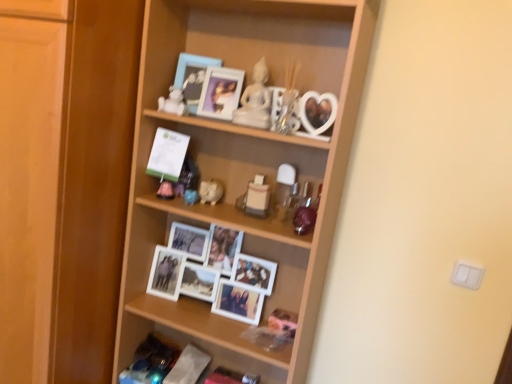
Question: From the image's perspective, is matte blue picture frame at upper center, the 1th picture frame from the left, below wooden shelf at center, marked as the second shelf in a bottom-to-top arrangement?

Choices:
 (A) yes
 (B) no

Answer: (B)

Question: Considering the relative sizes of matte blue picture frame at upper center, the 1th picture frame from the left, and wooden shelf at center, marked as the second shelf in a bottom-to-top arrangement, in the image provided, is matte blue picture frame at upper center, the 1th picture frame from the left, wider than wooden shelf at center, marked as the second shelf in a bottom-to-top arrangement,?

Choices:
 (A) no
 (B) yes

Answer: (A)

Question: Is matte blue picture frame at upper center, the 1th picture frame from the left, positioned far away from wooden shelf at center, marked as the second shelf in a bottom-to-top arrangement?

Choices:
 (A) no
 (B) yes

Answer: (A)

Question: Are matte blue picture frame at upper center, which is the second picture frame from right to left, and wooden shelf at center, which is counted as the 1th shelf, starting from the top, making contact?

Choices:
 (A) yes
 (B) no

Answer: (B)

Question: Is matte blue picture frame at upper center, the 1th picture frame from the left, smaller than wooden shelf at center, marked as the second shelf in a bottom-to-top arrangement?

Choices:
 (A) yes
 (B) no

Answer: (A)

Question: Is white glossy piggy bank at center, the second toy positioned from the bottom, taller or shorter than matte plastic toy at center, the third toy ordered from the bottom?

Choices:
 (A) short
 (B) tall

Answer: (A)

Question: Relative to matte plastic toy at center, the 3th toy when ordered from top to bottom, is white glossy piggy bank at center, placed as the 4th toy when sorted from top to bottom, in front or behind?

Choices:
 (A) front
 (B) behind

Answer: (A)

Question: Is point (216, 190) closer or farther from the camera than point (167, 195)?

Choices:
 (A) closer
 (B) farther

Answer: (B)

Question: Would you say white glossy piggy bank at center, placed as the 4th toy when sorted from top to bottom, is to the left or to the right of matte plastic toy at center, the third toy ordered from the bottom, in the picture?

Choices:
 (A) right
 (B) left

Answer: (A)

Question: From the image's perspective, is green paper at center positioned above or below matte plastic picture frame at upper center, marked as the second picture frame in a left-to-right arrangement?

Choices:
 (A) above
 (B) below

Answer: (B)

Question: Considering their positions, is green paper at center located in front of or behind matte plastic picture frame at upper center, which is counted as the 1th picture frame, starting from the right?

Choices:
 (A) front
 (B) behind

Answer: (B)

Question: Is green paper at center taller or shorter than matte plastic picture frame at upper center, marked as the second picture frame in a left-to-right arrangement?

Choices:
 (A) tall
 (B) short

Answer: (A)

Question: In terms of size, does green paper at center appear bigger or smaller than matte plastic picture frame at upper center, which is counted as the 1th picture frame, starting from the right?

Choices:
 (A) big
 (B) small

Answer: (B)

Question: Considering their positions, is white glossy piggy bank at center, the second toy positioned from the bottom, located in front of or behind matte plastic toy at center, acting as the 5th toy starting from the top?

Choices:
 (A) behind
 (B) front

Answer: (A)

Question: From the image's perspective, is white glossy piggy bank at center, the second toy positioned from the bottom, above or below matte plastic toy at center, which ranks as the 1th toy in bottom-to-top order?

Choices:
 (A) below
 (B) above

Answer: (B)